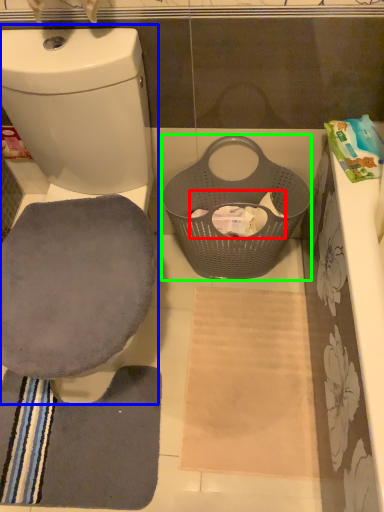
Question: Which object is positioned closest to toilet paper (highlighted by a red box)? Select from toilet (highlighted by a blue box) and basket (highlighted by a green box).

Choices:
 (A) toilet
 (B) basket

Answer: (B)